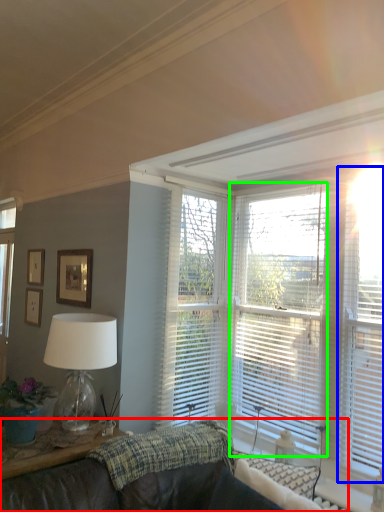
Question: Estimate the real-world distances between objects in this image. Which object is closer to studio couch (highlighted by a red box), blind (highlighted by a blue box) or window blind (highlighted by a green box)?

Choices:
 (A) blind
 (B) window blind

Answer: (B)